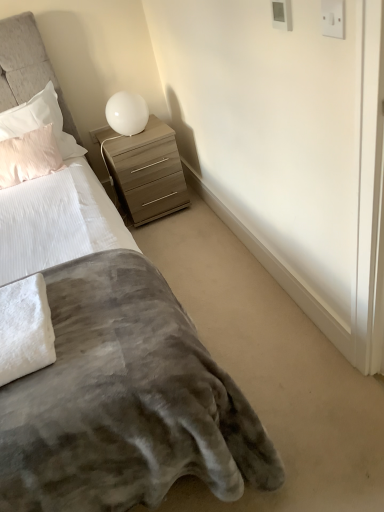
I want to click on free space on the front side of white glossy table lamp at upper right, so click(x=131, y=142).